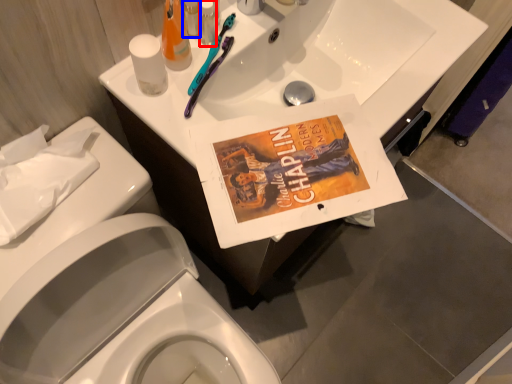
Question: Which point is further to the camera, toiletry (highlighted by a red box) or toiletry (highlighted by a blue box)?

Choices:
 (A) toiletry
 (B) toiletry

Answer: (B)